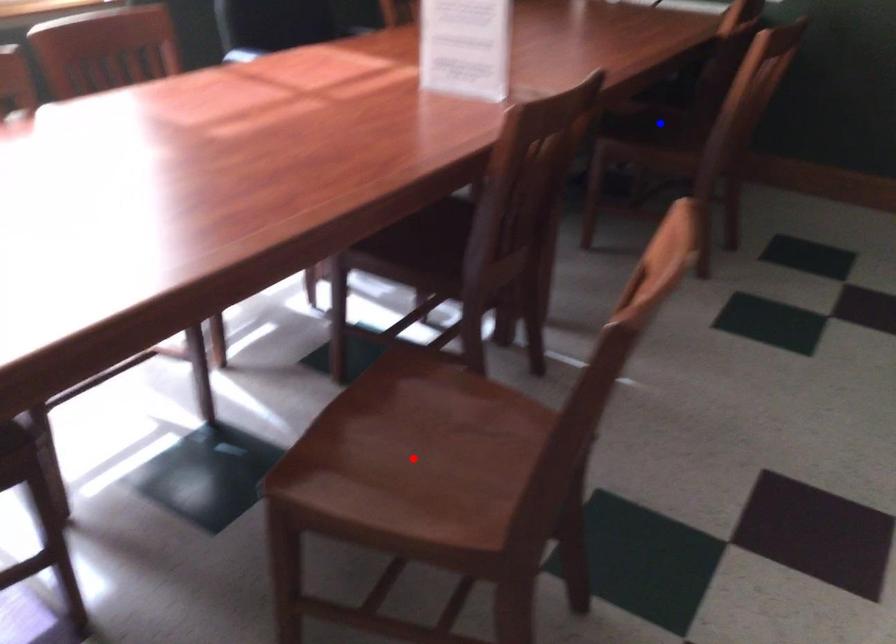
Question: Which of the two points in the image is closer to the camera?

Choices:
 (A) Blue point is closer.
 (B) Red point is closer.

Answer: (B)